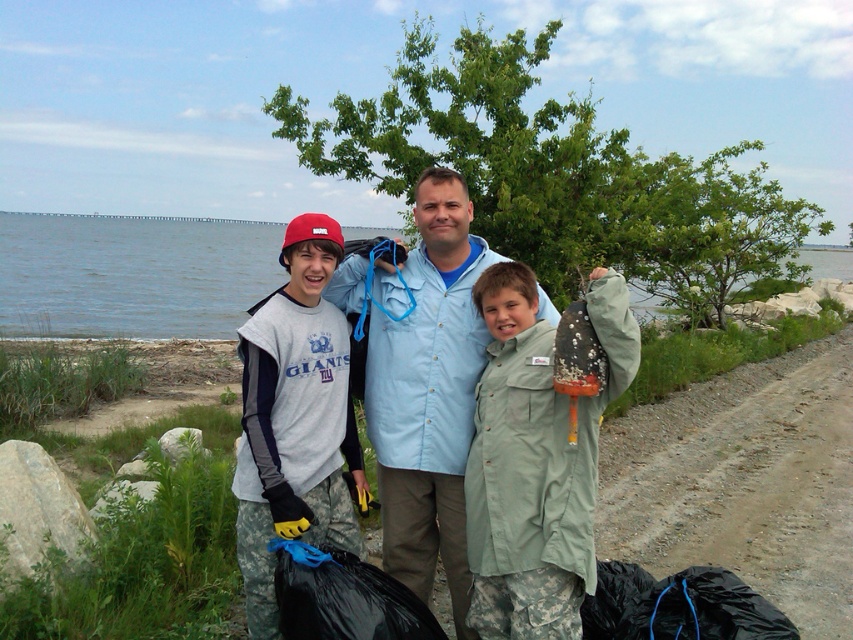
Which is behind, point (525, 509) or point (363, 499)?

Point (363, 499)

Between point (589, 317) and point (241, 451), which one is positioned in front?

Point (589, 317) is in front.

This screenshot has height=640, width=853. Identify the location of green matte jacket at center. (537, 460).

Is point (511, 417) positioned after point (453, 413)?

No, it is in front of (453, 413).

Which of these two, green matte jacket at center or light blue shirt at center, stands shorter?

With less height is green matte jacket at center.

At what (x,y) coordinates should I click in order to perform the action: click on green matte jacket at center. Please return your answer as a coordinate pair (x, y). The height and width of the screenshot is (640, 853). Looking at the image, I should click on (537, 460).

Is gray camouflage pants at center below blue water at center?

Yes, gray camouflage pants at center is below blue water at center.

Is point (257, 369) behind point (102, 300)?

No.

Does point (299, 348) come farther from viewer compared to point (276, 269)?

No, it is not.

Find the location of a particular element. The width and height of the screenshot is (853, 640). gray camouflage pants at center is located at coordinates (294, 419).